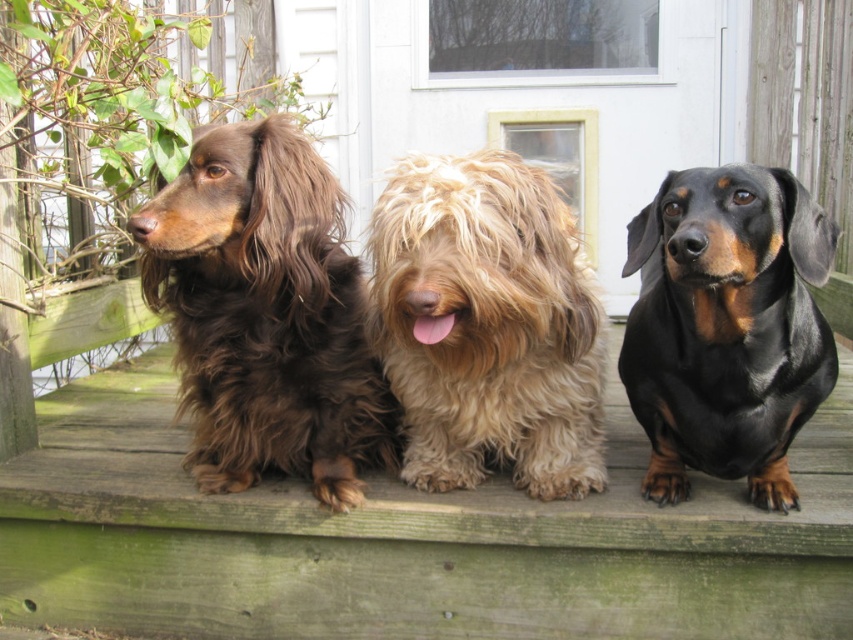
You are standing on the wooden deck and want to locate the shiny brown fur at center. What are its coordinates?

The shiny brown fur at center is located at the 2D coordinates point [265,314].

You are standing on the wooden deck and see the shiny brown fur at center and the black shiny dog at center. Which dog is positioned to the right side?

The black shiny dog at center is positioned to the right side of the shiny brown fur at center.